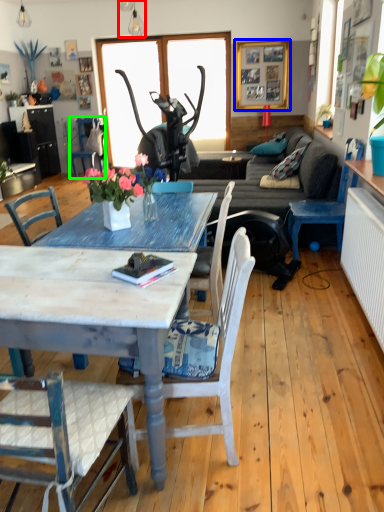
Question: Which object is the closest to the lamp (highlighted by a red box)? Choose among these: picture frame (highlighted by a blue box) or chair (highlighted by a green box).

Choices:
 (A) picture frame
 (B) chair

Answer: (B)